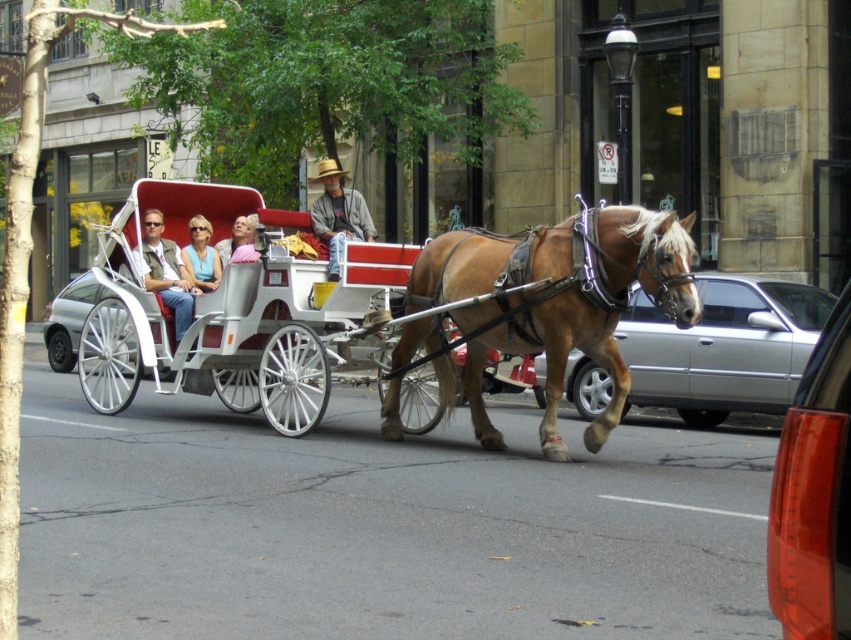
Question: Is white glossy carriage wheel at center wider than pink fabric at center?

Choices:
 (A) yes
 (B) no

Answer: (A)

Question: Which object appears closest to the camera in this image?

Choices:
 (A) silver metallic car at center
 (B) matte black car at right
 (C) pink fabric at center
 (D) matte black vest at left

Answer: (B)

Question: Which object is the closest to the silver metallic car at center?

Choices:
 (A) white polished wood cart at center
 (B) matte black car at right

Answer: (A)

Question: Which point is farther to the camera?

Choices:
 (A) (77, 276)
 (B) (233, 228)
 (C) (834, 324)
 (D) (330, 198)

Answer: (A)

Question: Can you confirm if denim jacket at center is positioned below pink fabric at center?

Choices:
 (A) no
 (B) yes

Answer: (A)

Question: Is white polished wood cart at center to the right of white glossy carriage wheel at center from the viewer's perspective?

Choices:
 (A) no
 (B) yes

Answer: (B)